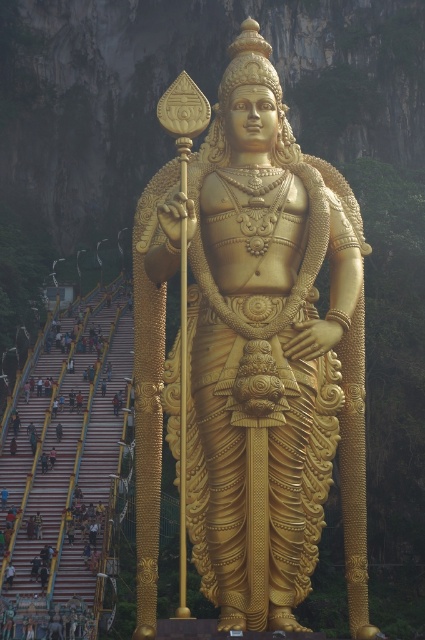
You are standing at the base of the staircase in the temple. You see two points marked in the image. The first point is at coordinates point (226, 419) and the second is at point (51, 464). Which point is closer to you?

Point (226, 419) is in front of point (51, 464), so the first point is closer to you.

From the picture: You are standing at the entrance of the temple and see the golden polished statue at center. If you walk straight ahead, will you approach the statue or move away from it?

Since the golden polished statue at center is located at point coordinates that are in the central part of the image, walking straight ahead from the entrance would likely bring you closer to the statue.